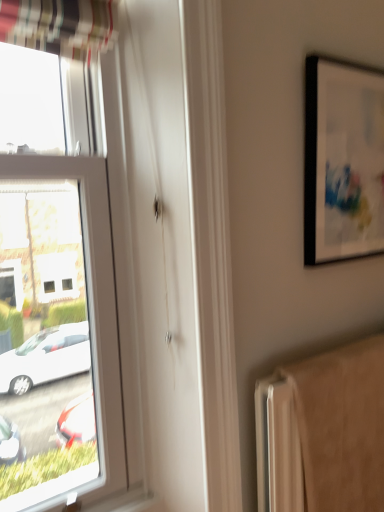
Question: Considering the relative positions of black matte picture frame at upper right and beige fabric radiator at lower right in the image provided, is black matte picture frame at upper right behind beige fabric radiator at lower right?

Choices:
 (A) no
 (B) yes

Answer: (B)

Question: Is black matte picture frame at upper right shorter than beige fabric radiator at lower right?

Choices:
 (A) no
 (B) yes

Answer: (B)

Question: Is black matte picture frame at upper right facing towards beige fabric radiator at lower right?

Choices:
 (A) yes
 (B) no

Answer: (B)

Question: Can you confirm if black matte picture frame at upper right is wider than beige fabric radiator at lower right?

Choices:
 (A) yes
 (B) no

Answer: (B)

Question: Is black matte picture frame at upper right turned away from beige fabric radiator at lower right?

Choices:
 (A) no
 (B) yes

Answer: (A)

Question: Does black matte picture frame at upper right appear on the left side of beige fabric radiator at lower right?

Choices:
 (A) no
 (B) yes

Answer: (A)

Question: Does beige fabric radiator at lower right appear on the left side of black matte picture frame at upper right?

Choices:
 (A) no
 (B) yes

Answer: (B)

Question: From a real-world perspective, is beige fabric radiator at lower right beneath black matte picture frame at upper right?

Choices:
 (A) no
 (B) yes

Answer: (B)

Question: Can you confirm if beige fabric radiator at lower right is thinner than black matte picture frame at upper right?

Choices:
 (A) yes
 (B) no

Answer: (B)

Question: From a real-world perspective, is beige fabric radiator at lower right over black matte picture frame at upper right?

Choices:
 (A) no
 (B) yes

Answer: (A)

Question: Considering the relative sizes of beige fabric radiator at lower right and black matte picture frame at upper right in the image provided, is beige fabric radiator at lower right bigger than black matte picture frame at upper right?

Choices:
 (A) no
 (B) yes

Answer: (B)

Question: Does beige fabric radiator at lower right have a lesser height compared to black matte picture frame at upper right?

Choices:
 (A) yes
 (B) no

Answer: (B)

Question: Considering the positions of point (286, 449) and point (347, 188), is point (286, 449) closer or farther from the camera than point (347, 188)?

Choices:
 (A) closer
 (B) farther

Answer: (A)